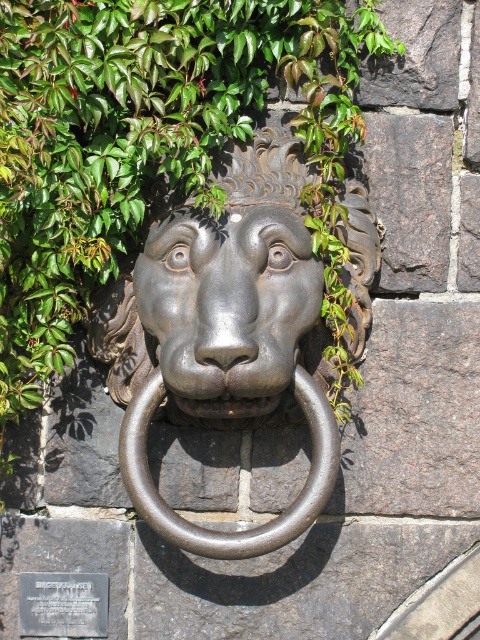
You are standing in front of the lion head door knocker and want to place a small decorative item on the green leafy plant at center. Based on the coordinates provided, where should you aim to place the item?

The green leafy plant at center is located at coordinates point (154, 147), so you should aim for that specific point to place the item there.

You are standing in front of a stone wall with a lion head door knocker. There is a green leafy plant at center. If you want to water the plant, which is 2 meters away from the water source, can you reach it without moving? Please explain.

The green leafy plant at center is 2.53 meters away from the viewer. Since the water source is 2 meters away, the plant is farther than the water source. Therefore, you cannot reach the plant without moving closer.

You are a gardener who wants to place a new plant pot in the courtyard. You have a green leafy plant at center and a matte bronze lion head at center in the scene. Which object is wider?

The green leafy plant at center is wider than the matte bronze lion head at center according to the description.